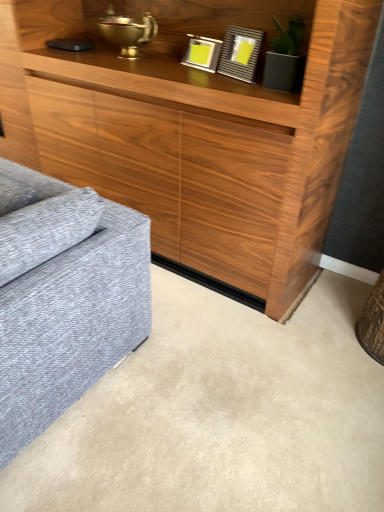
This screenshot has width=384, height=512. What do you see at coordinates (240, 53) in the screenshot?
I see `matte gray picture frame at upper center, the 1th picture frame viewed from the right` at bounding box center [240, 53].

I want to click on matte gray picture frame at upper center, the 2th picture frame positioned from the left, so click(240, 53).

Measure the distance between matte gray picture frame at upper center, the 1th picture frame viewed from the right, and camera.

The depth of matte gray picture frame at upper center, the 1th picture frame viewed from the right, is 1.72 meters.

What is the approximate height of metallic silver picture frame at upper center, the second picture frame in the right-to-left sequence?

metallic silver picture frame at upper center, the second picture frame in the right-to-left sequence, is 6.49 inches tall.

Identify the location of metallic silver picture frame at upper center, the second picture frame in the right-to-left sequence. (202, 53).

What do you see at coordinates (202, 53) in the screenshot? I see `metallic silver picture frame at upper center, the second picture frame in the right-to-left sequence` at bounding box center [202, 53].

Where is `matte gray picture frame at upper center, the 2th picture frame positioned from the left`? Image resolution: width=384 pixels, height=512 pixels. matte gray picture frame at upper center, the 2th picture frame positioned from the left is located at coordinates (240, 53).

Which is more to the right, matte gray picture frame at upper center, the 2th picture frame positioned from the left, or metallic silver picture frame at upper center, the second picture frame in the right-to-left sequence?

From the viewer's perspective, matte gray picture frame at upper center, the 2th picture frame positioned from the left, appears more on the right side.

Between matte gray picture frame at upper center, the 1th picture frame viewed from the right, and metallic silver picture frame at upper center, the second picture frame in the right-to-left sequence, which one is positioned behind?

metallic silver picture frame at upper center, the second picture frame in the right-to-left sequence, is further away from the camera.

Is point (240, 57) less distant than point (206, 53)?

Yes.

From the image's perspective, is matte gray picture frame at upper center, the 2th picture frame positioned from the left, positioned above or below metallic silver picture frame at upper center, acting as the first picture frame starting from the left?

Based on their image positions, matte gray picture frame at upper center, the 2th picture frame positioned from the left, is located beneath metallic silver picture frame at upper center, acting as the first picture frame starting from the left.

From a real-world perspective, does matte gray picture frame at upper center, the 2th picture frame positioned from the left, sit lower than metallic silver picture frame at upper center, acting as the first picture frame starting from the left?

No, from a real-world perspective, matte gray picture frame at upper center, the 2th picture frame positioned from the left, is not beneath metallic silver picture frame at upper center, acting as the first picture frame starting from the left.

Between matte gray picture frame at upper center, the 2th picture frame positioned from the left, and metallic silver picture frame at upper center, acting as the first picture frame starting from the left, which one has smaller width?

Thinner between the two is metallic silver picture frame at upper center, acting as the first picture frame starting from the left.

Who is taller, matte gray picture frame at upper center, the 1th picture frame viewed from the right, or metallic silver picture frame at upper center, acting as the first picture frame starting from the left?

With more height is matte gray picture frame at upper center, the 1th picture frame viewed from the right.

Consider the image. Can you confirm if matte gray picture frame at upper center, the 2th picture frame positioned from the left, is smaller than metallic silver picture frame at upper center, the second picture frame in the right-to-left sequence?

Actually, matte gray picture frame at upper center, the 2th picture frame positioned from the left, might be larger than metallic silver picture frame at upper center, the second picture frame in the right-to-left sequence.

Could metallic silver picture frame at upper center, the second picture frame in the right-to-left sequence, be considered to be inside matte gray picture frame at upper center, the 2th picture frame positioned from the left?

No, metallic silver picture frame at upper center, the second picture frame in the right-to-left sequence, is not inside matte gray picture frame at upper center, the 2th picture frame positioned from the left.

Is matte gray picture frame at upper center, the 1th picture frame viewed from the right, beside metallic silver picture frame at upper center, the second picture frame in the right-to-left sequence?

No, matte gray picture frame at upper center, the 1th picture frame viewed from the right, is not touching metallic silver picture frame at upper center, the second picture frame in the right-to-left sequence.

Is matte gray picture frame at upper center, the 1th picture frame viewed from the right, aimed at metallic silver picture frame at upper center, acting as the first picture frame starting from the left?

No, matte gray picture frame at upper center, the 1th picture frame viewed from the right, does not turn towards metallic silver picture frame at upper center, acting as the first picture frame starting from the left.

How different are the orientations of matte gray picture frame at upper center, the 1th picture frame viewed from the right, and metallic silver picture frame at upper center, acting as the first picture frame starting from the left, in degrees?

12.6 degrees.

In order to click on picture frame lying above the matte gray picture frame at upper center, the 1th picture frame viewed from the right (from the image's perspective) in this screenshot , I will do `click(202, 53)`.

Does metallic silver picture frame at upper center, acting as the first picture frame starting from the left, appear on the left side of matte gray picture frame at upper center, the 2th picture frame positioned from the left?

Yes, metallic silver picture frame at upper center, acting as the first picture frame starting from the left, is to the left of matte gray picture frame at upper center, the 2th picture frame positioned from the left.

Which object is further away from the camera, metallic silver picture frame at upper center, the second picture frame in the right-to-left sequence, or matte gray picture frame at upper center, the 1th picture frame viewed from the right?

Positioned behind is metallic silver picture frame at upper center, the second picture frame in the right-to-left sequence.

Is point (205, 54) in front of point (229, 70)?

No.

Looking at this image, from the image's perspective, which one is positioned lower, metallic silver picture frame at upper center, the second picture frame in the right-to-left sequence, or matte gray picture frame at upper center, the 2th picture frame positioned from the left?

matte gray picture frame at upper center, the 2th picture frame positioned from the left.

From a real-world perspective, between metallic silver picture frame at upper center, the second picture frame in the right-to-left sequence, and matte gray picture frame at upper center, the 2th picture frame positioned from the left, who is vertically higher?

matte gray picture frame at upper center, the 2th picture frame positioned from the left, is physically above.

Considering the relative sizes of metallic silver picture frame at upper center, the second picture frame in the right-to-left sequence, and matte gray picture frame at upper center, the 1th picture frame viewed from the right, in the image provided, is metallic silver picture frame at upper center, the second picture frame in the right-to-left sequence, wider than matte gray picture frame at upper center, the 1th picture frame viewed from the right,?

No, metallic silver picture frame at upper center, the second picture frame in the right-to-left sequence, is not wider than matte gray picture frame at upper center, the 1th picture frame viewed from the right.

Can you confirm if metallic silver picture frame at upper center, acting as the first picture frame starting from the left, is taller than matte gray picture frame at upper center, the 2th picture frame positioned from the left?

No, metallic silver picture frame at upper center, acting as the first picture frame starting from the left, is not taller than matte gray picture frame at upper center, the 2th picture frame positioned from the left.

Considering the relative sizes of metallic silver picture frame at upper center, acting as the first picture frame starting from the left, and matte gray picture frame at upper center, the 1th picture frame viewed from the right, in the image provided, is metallic silver picture frame at upper center, acting as the first picture frame starting from the left, bigger than matte gray picture frame at upper center, the 1th picture frame viewed from the right,?

No, metallic silver picture frame at upper center, acting as the first picture frame starting from the left, is not bigger than matte gray picture frame at upper center, the 1th picture frame viewed from the right.

Is metallic silver picture frame at upper center, acting as the first picture frame starting from the left, outside of matte gray picture frame at upper center, the 2th picture frame positioned from the left?

metallic silver picture frame at upper center, acting as the first picture frame starting from the left, is positioned outside matte gray picture frame at upper center, the 2th picture frame positioned from the left.

Are metallic silver picture frame at upper center, the second picture frame in the right-to-left sequence, and matte gray picture frame at upper center, the 1th picture frame viewed from the right, making contact?

metallic silver picture frame at upper center, the second picture frame in the right-to-left sequence, and matte gray picture frame at upper center, the 1th picture frame viewed from the right, are clearly separated.

Is matte gray picture frame at upper center, the 2th picture frame positioned from the left, at the back of metallic silver picture frame at upper center, acting as the first picture frame starting from the left?

No, matte gray picture frame at upper center, the 2th picture frame positioned from the left, is not at the back of metallic silver picture frame at upper center, acting as the first picture frame starting from the left.

In the scene shown: What's the angular difference between metallic silver picture frame at upper center, the second picture frame in the right-to-left sequence, and matte gray picture frame at upper center, the 2th picture frame positioned from the left,'s facing directions?

12.6 degrees.

The width and height of the screenshot is (384, 512). I want to click on picture frame above the matte gray picture frame at upper center, the 1th picture frame viewed from the right (from the image's perspective), so click(x=202, y=53).

The height and width of the screenshot is (512, 384). Find the location of `picture frame below the matte gray picture frame at upper center, the 1th picture frame viewed from the right (from a real-world perspective)`. picture frame below the matte gray picture frame at upper center, the 1th picture frame viewed from the right (from a real-world perspective) is located at coordinates (202, 53).

Locate an element on the screen. The image size is (384, 512). picture frame behind the matte gray picture frame at upper center, the 1th picture frame viewed from the right is located at coordinates (202, 53).